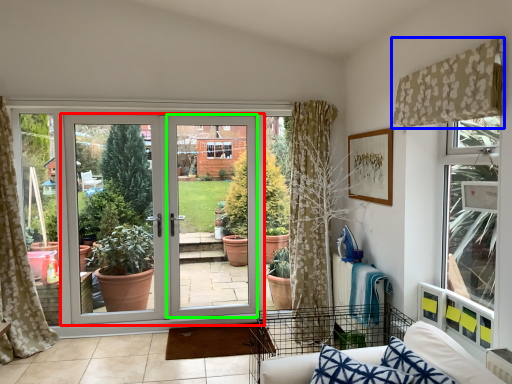
Question: Which is farther away from door (highlighted by a red box)? curtain (highlighted by a blue box) or screen door (highlighted by a green box)?

Choices:
 (A) curtain
 (B) screen door

Answer: (A)